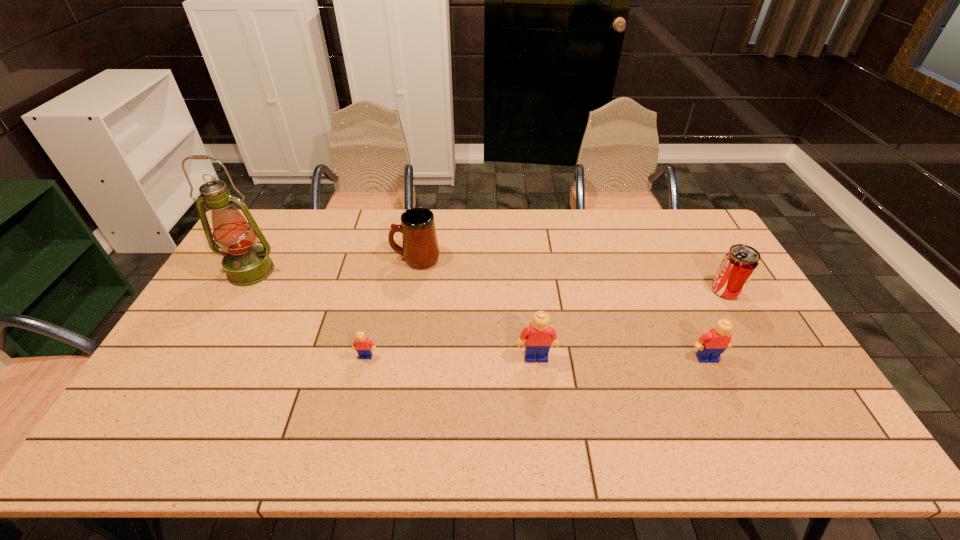
Find the location of a particular element. vacant point located between the second Lego from right to left and the rightmost object is located at coordinates click(x=631, y=324).

You are a GUI agent. You are given a task and a screenshot of the screen. Output one action in this format:
    pyautogui.click(x=<x>, y=<y>)
    Task: Click on the empty space that is in between the mug and the rightmost Lego
    The image size is (960, 540).
    Given the screenshot: What is the action you would take?
    pyautogui.click(x=562, y=308)

You are a GUI agent. You are given a task and a screenshot of the screen. Output one action in this format:
    pyautogui.click(x=<x>, y=<y>)
    Task: Click on the free space that is in between the rightmost Lego and the mug
    This screenshot has height=540, width=960.
    Given the screenshot: What is the action you would take?
    pyautogui.click(x=562, y=308)

Where is `free spot between the leftmost object and the mug`? This screenshot has height=540, width=960. free spot between the leftmost object and the mug is located at coordinates (333, 265).

Point out which object is positioned as the fourth nearest to the leftmost Lego. Please provide its 2D coordinates. Your answer should be formatted as a tuple, i.e. [(x, y)], where the tuple contains the x and y coordinates of a point satisfying the conditions above.

[(711, 345)]

Identify which object is the fifth closest to the rightmost Lego. Please provide its 2D coordinates. Your answer should be formatted as a tuple, i.e. [(x, y)], where the tuple contains the x and y coordinates of a point satisfying the conditions above.

[(245, 263)]

Locate an element on the screen. Lego that stands as the closest to the pop soda is located at coordinates (711, 345).

Identify which Lego is the nearest to the leftmost object. Please provide its 2D coordinates. Your answer should be formatted as a tuple, i.e. [(x, y)], where the tuple contains the x and y coordinates of a point satisfying the conditions above.

[(361, 344)]

The width and height of the screenshot is (960, 540). I want to click on vacant area in the image that satisfies the following two spatial constraints: 1. on the side of the mug with the handle; 2. on the front side of the tallest object, so click(414, 271).

I want to click on vacant space that satisfies the following two spatial constraints: 1. on the front side of the pop soda; 2. on the right side of the tallest object, so click(x=240, y=291).